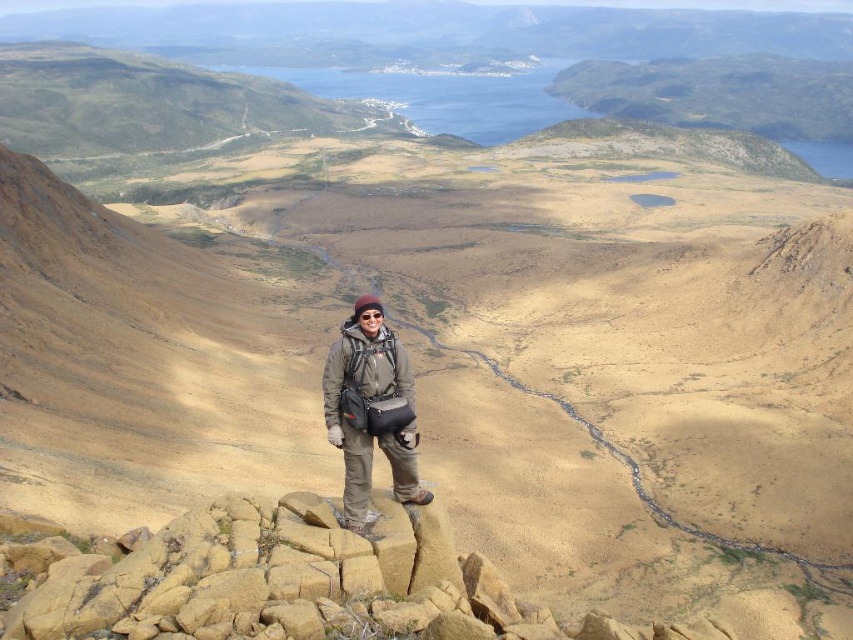
You are a hiker standing on the yellow rock at center. You want to take a photo of the surrounding landscape. Which direction should you face to capture the entire view without any obstructions?

The yellow rock at center is located at point [296,582], so facing north would ensure the entire view is captured without obstructions.

You are a hiker standing at the point with coordinates (296, 582). Looking around, you see a yellow rock at center. Which direction should you face to see the yellow rock at center?

The yellow rock at center is located at your current position, so you are already facing it.

You are a photographer planning to take a photo of the yellow rock at center and the matte gray jacket at center. Based on their positions, which object is closer to the camera?

The yellow rock at center is positioned under the matte gray jacket at center, meaning it is closer to the camera.